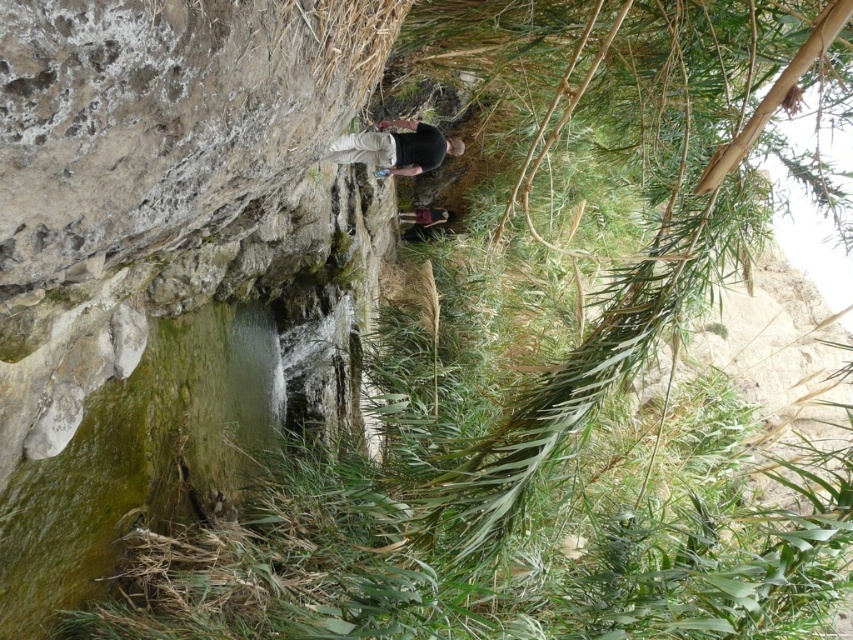
You are hiking near a stream and see the rough stone cliff at upper left and the black matte shirt at center. Which object appears larger in the image?

The black matte shirt at center appears larger than the rough stone cliff at upper left.

You are hiking near a stream and see the rough stone cliff at upper left and the black matte shirt at center. Which object is closer to you as you stand at the stream?

The rough stone cliff at upper left is closer to you because it is in front of the black matte shirt at center.